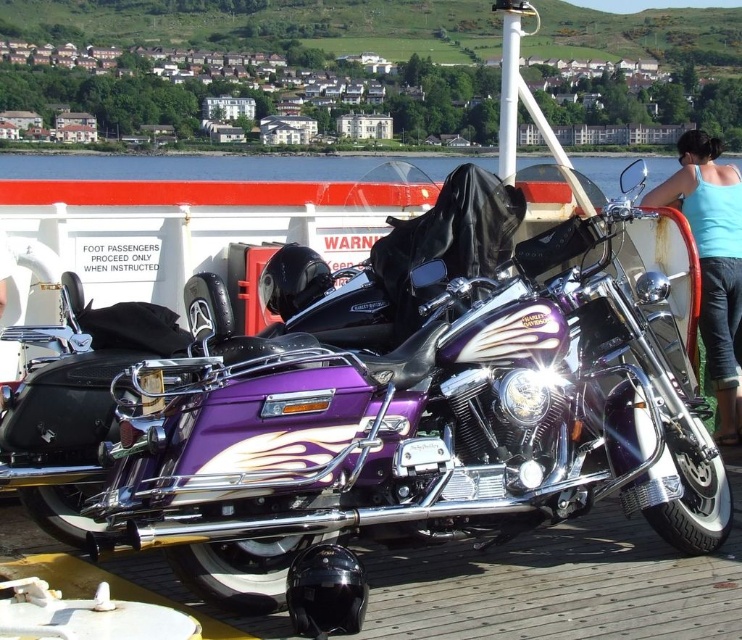
You are standing on the ferry deck and want to move from the purple Harley to the black motorcycle. Which direction should you move to go from point (x=62, y=428) to point (x=735, y=390)?

To move from point (x=62, y=428) to point (x=735, y=390), you should move backward since point (x=62, y=428) is in front of point (x=735, y=390).

You are a photographer standing on the ferry deck. You want to take a photo of the purple glossy motorcycle at center and the blue fabric tank top at upper right. Can you position yourself so that both subjects are visible in the same frame without moving any objects?

Yes, the purple glossy motorcycle at center is located below the blue fabric tank top at upper right, so positioning yourself at a lower angle would allow both subjects to be captured in the same frame.